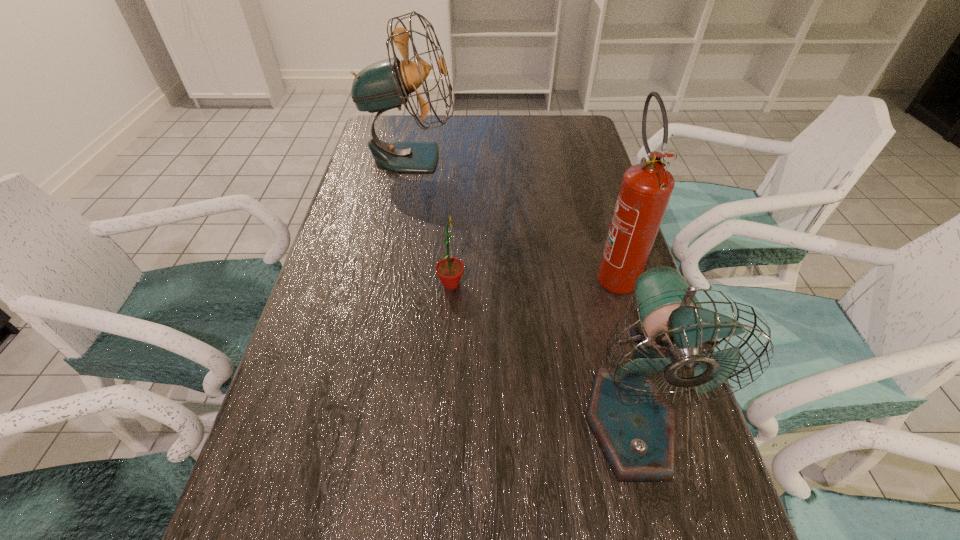
Identify the location of free space between the farthest object and the shortest object. (431, 221).

Locate an element on the screen. empty space between the farthest object and the sunflower is located at coordinates (431, 221).

At what (x,y) coordinates should I click in order to perform the action: click on free spot between the nearer fan and the sunflower. Please return your answer as a coordinate pair (x, y). The image size is (960, 540). Looking at the image, I should click on (540, 353).

I want to click on vacant region between the farthest object and the nearest object, so click(520, 289).

The image size is (960, 540). In order to click on free space between the sunflower and the nearer fan in this screenshot , I will do `click(540, 353)`.

The image size is (960, 540). I want to click on empty space that is in between the farther fan and the fire extinguisher, so point(513,215).

The image size is (960, 540). I want to click on vacant space that is in between the right fan and the fire extinguisher, so click(622, 348).

The height and width of the screenshot is (540, 960). What are the coordinates of `vacant region between the left fan and the nearer fan` in the screenshot? It's located at (520, 289).

In order to click on unoccupied area between the fire extinguisher and the right fan in this screenshot , I will do `click(622, 348)`.

This screenshot has width=960, height=540. What are the coordinates of `the second closest object to the sunflower` in the screenshot? It's located at (646, 188).